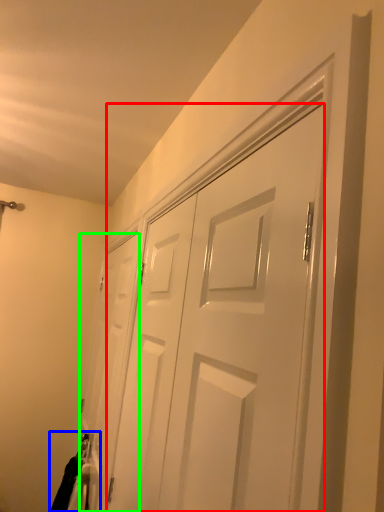
Question: Which object is positioned closest to door (highlighted by a red box)? Select from laundry (highlighted by a blue box) and door (highlighted by a green box).

Choices:
 (A) laundry
 (B) door

Answer: (B)